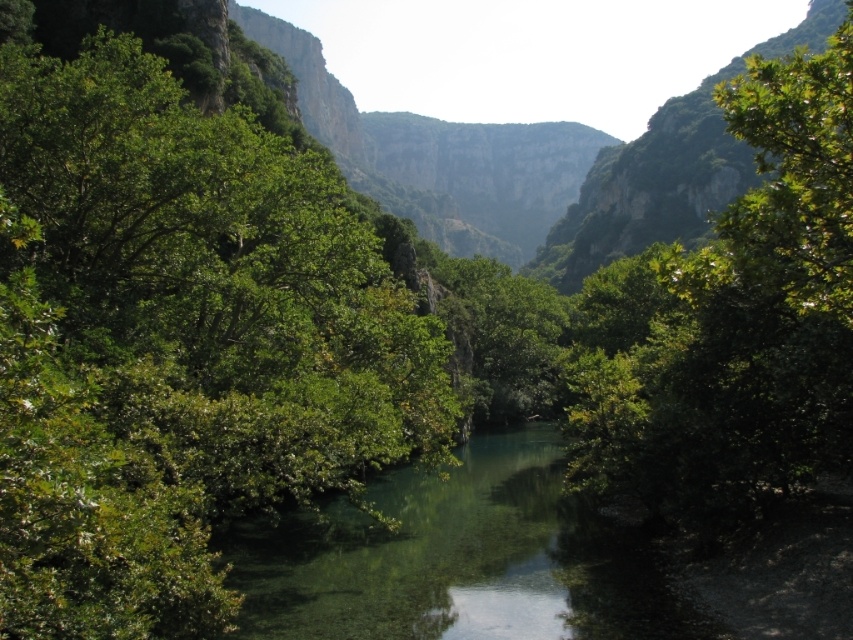
Question: Is green leafy tree at left positioned before clear water at center?

Choices:
 (A) no
 (B) yes

Answer: (B)

Question: Can you confirm if green leafy tree at left is thinner than clear water at center?

Choices:
 (A) yes
 (B) no

Answer: (B)

Question: Is green leafy tree at left positioned behind clear water at center?

Choices:
 (A) yes
 (B) no

Answer: (B)

Question: Which point is closer to the camera?

Choices:
 (A) clear water at center
 (B) green leafy tree at left

Answer: (B)